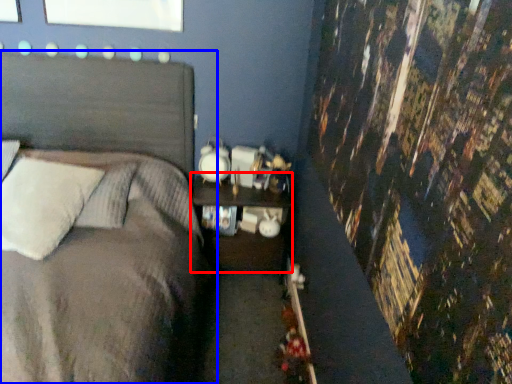
Question: Which object appears closest to the camera in this image, nightstand (highlighted by a red box) or bed (highlighted by a blue box)?

Choices:
 (A) nightstand
 (B) bed

Answer: (B)